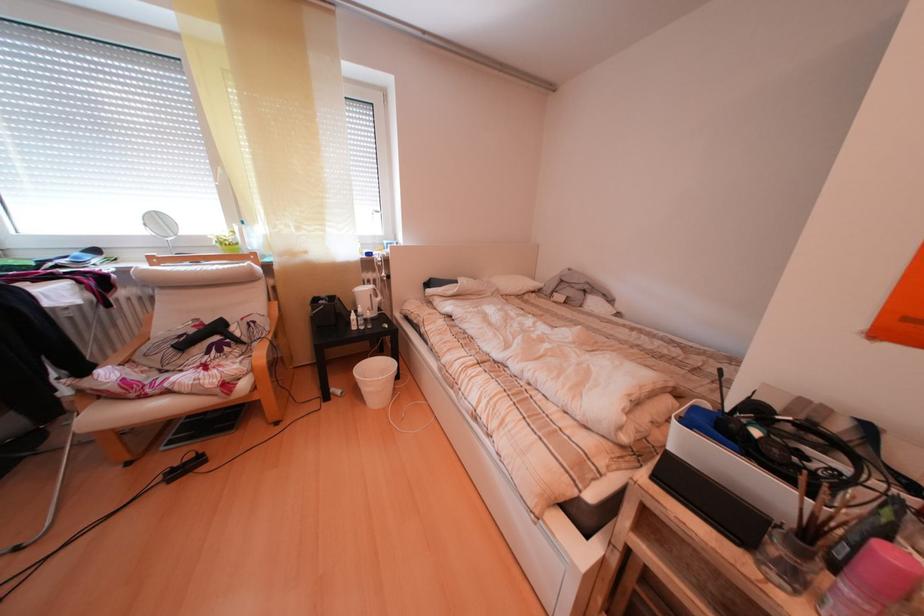
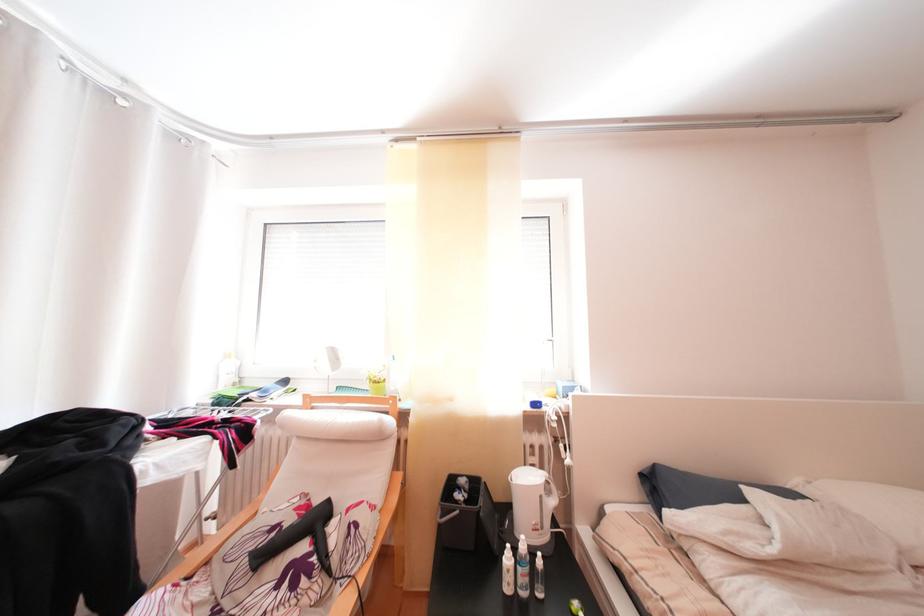
Where in the second image is the point corresponding to the point at 383,299 from the first image?

(554, 498)